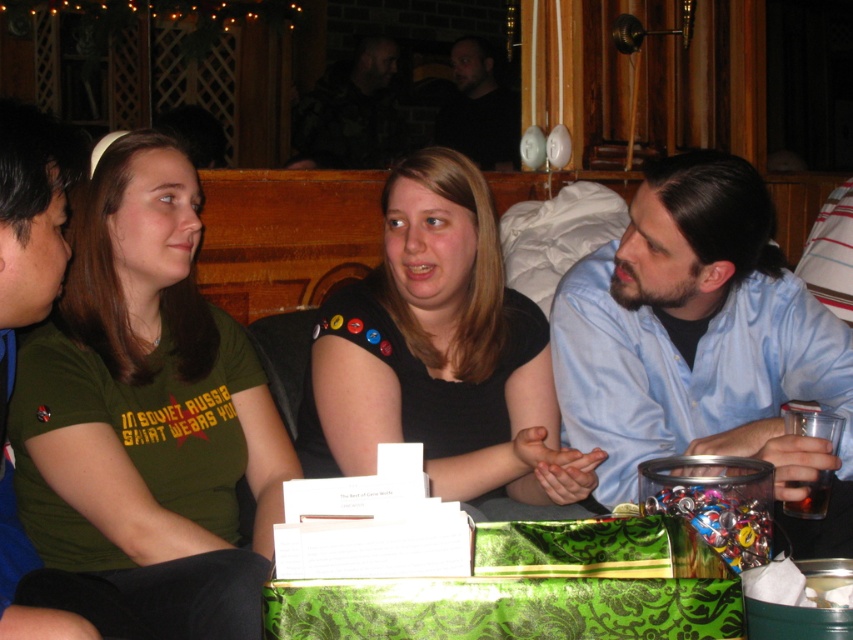
You are a photographer at the event and want to ensure all attendees fit in a group photo. If the green matte shirt at left is narrower than the blue shirt at center, will the two shirts combined take up more than half the width of the frame?

The green matte shirt at left is less wide than the blue shirt at center. Adding their widths together, it depends on the total frame width, but since the question doesn

In the scene where four people are sitting together at an indoor event with wooden paneling and warm lighting, you notice two shirts. The green matte shirt at left and the blue shirt at center. Which shirt is positioned closer to the left side of the group?

The green matte shirt at left is positioned closer to the left side of the group because it is to the left of the blue shirt at center.

You are standing at the point labeled as point (817, 435) in the image. Looking towards the other point, which direction would you face to see the point labeled point (474, 65)?

Since point (474, 65) is behind point (817, 435), you would need to turn around and face the opposite direction to see point (474, 65).